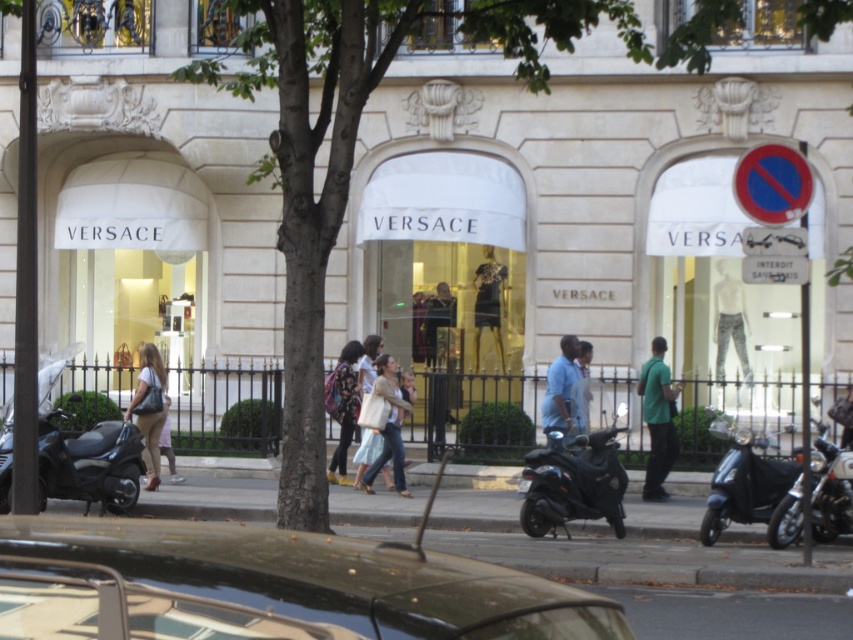
Question: Is light beige fabric handbag at center to the left of blue shirt at center from the viewer's perspective?

Choices:
 (A) yes
 (B) no

Answer: (A)

Question: Which point is closer to the camera?

Choices:
 (A) green leafy tree at center
 (B) shiny chrome motorcycle at lower right
 (C) green matte shirt at center

Answer: (A)

Question: Which object is the closest to the black matte scooter at left?

Choices:
 (A) light beige fabric handbag at center
 (B) matte beige handbag at center
 (C) shiny black scooter at lower right

Answer: (B)

Question: Based on their relative distances, which object is nearer to the black matte scooter at left?

Choices:
 (A) metallic gray car at center
 (B) shiny chrome motorcycle at lower right
 (C) floral-patterned fabric at center

Answer: (C)

Question: Does green leafy tree at center appear over light beige fabric handbag at center?

Choices:
 (A) no
 (B) yes

Answer: (B)

Question: Can you confirm if metallic gray car at center is positioned below shiny black scooter at center?

Choices:
 (A) no
 (B) yes

Answer: (A)